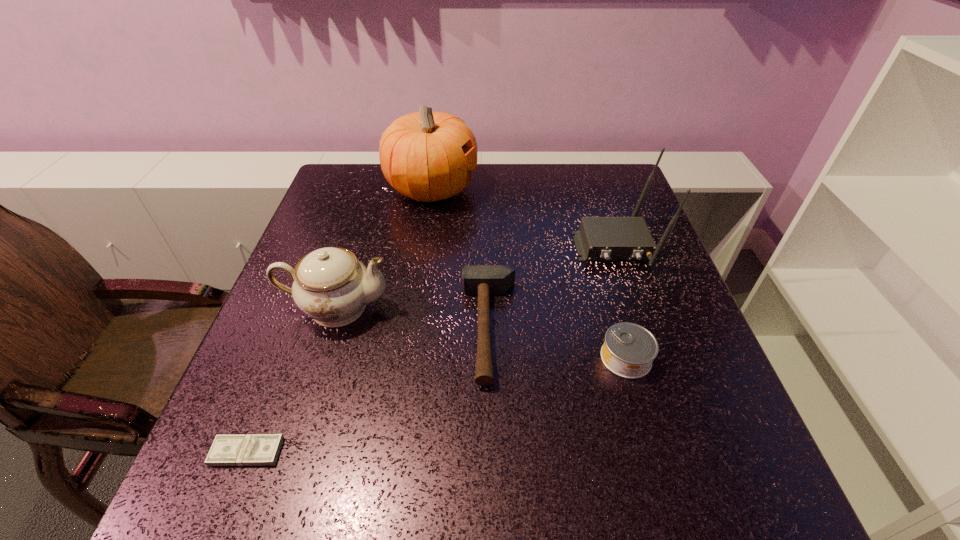
Where is `empty location between the pumpkin and the chinaware`? Image resolution: width=960 pixels, height=540 pixels. empty location between the pumpkin and the chinaware is located at coordinates (384, 248).

Find the location of a particular element. This screenshot has width=960, height=540. free area in between the can and the hammer is located at coordinates (558, 343).

The height and width of the screenshot is (540, 960). Find the location of `free spot between the can and the hammer`. free spot between the can and the hammer is located at coordinates (558, 343).

Locate an element on the screen. This screenshot has height=540, width=960. vacant space that is in between the shortest object and the hammer is located at coordinates click(368, 390).

Identify the location of free point between the can and the second farthest object. This screenshot has width=960, height=540. (620, 302).

Where is `object that is the third nearest to the can`? The image size is (960, 540). object that is the third nearest to the can is located at coordinates [330, 285].

In order to click on the third closest object relative to the chinaware in this screenshot , I will do `click(427, 156)`.

You are a GUI agent. You are given a task and a screenshot of the screen. Output one action in this format:
    pyautogui.click(x=<x>, y=<y>)
    Task: Click on the vacant region that satisfies the following two spatial constraints: 1. on the back of the fifth nearest object to connect cables; 2. at the spout of the chinaware
    Image resolution: width=960 pixels, height=540 pixels.
    Given the screenshot: What is the action you would take?
    pyautogui.click(x=636, y=308)

The height and width of the screenshot is (540, 960). Identify the location of vacant region that satisfies the following two spatial constraints: 1. on the back of the fifth nearest object to connect cables; 2. at the spout of the chinaware. pos(636,308).

You are a GUI agent. You are given a task and a screenshot of the screen. Output one action in this format:
    pyautogui.click(x=<x>, y=<y>)
    Task: Click on the free spot that satisfies the following two spatial constraints: 1. on the striking surface of the can; 2. on the left side of the hammer
    The height and width of the screenshot is (540, 960).
    Given the screenshot: What is the action you would take?
    pyautogui.click(x=490, y=358)